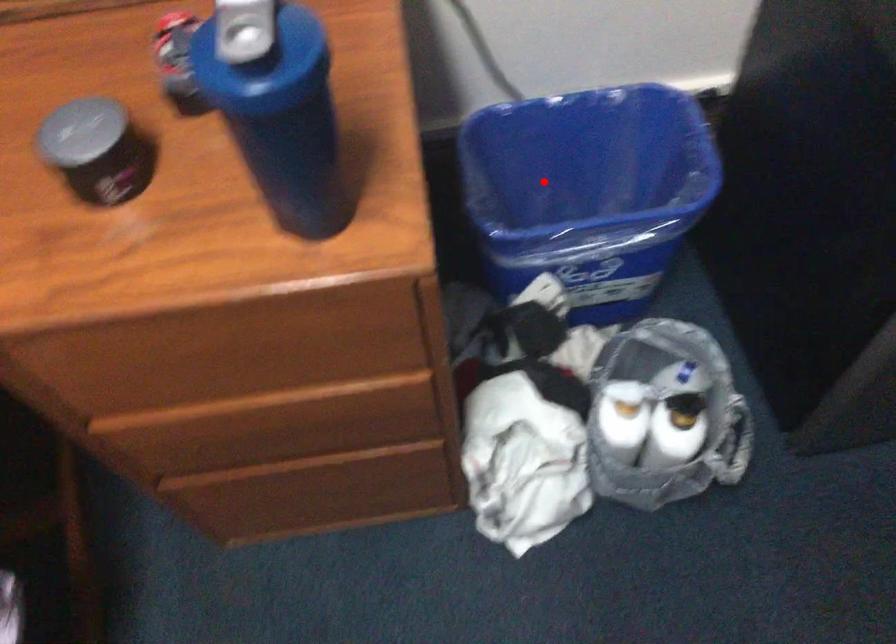
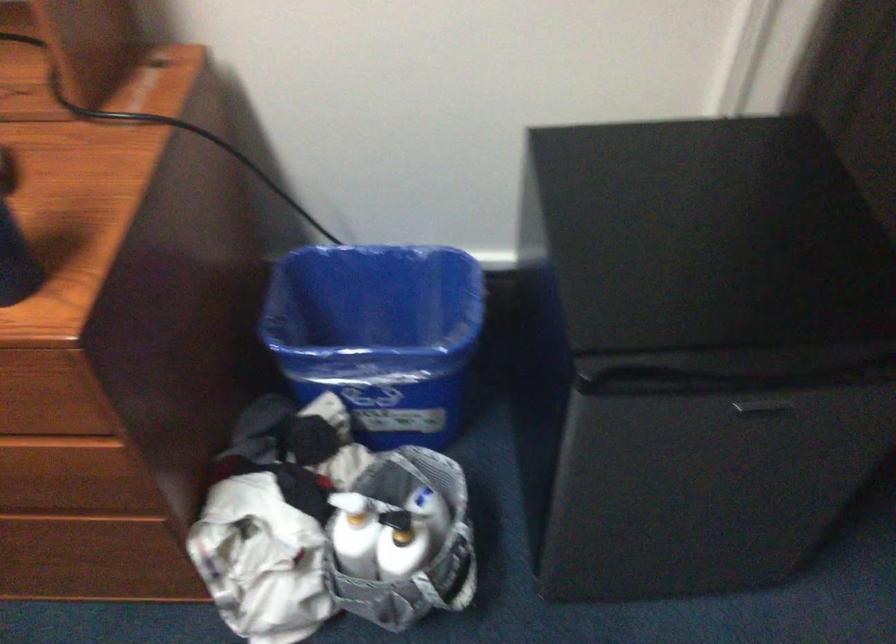
Question: I am providing you with two images of the same scene from different viewpoints. A red point is shown in image1. For the corresponding object point in image2, is it positioned nearer or farther from the camera?

Choices:
 (A) Nearer
 (B) Farther

Answer: (B)